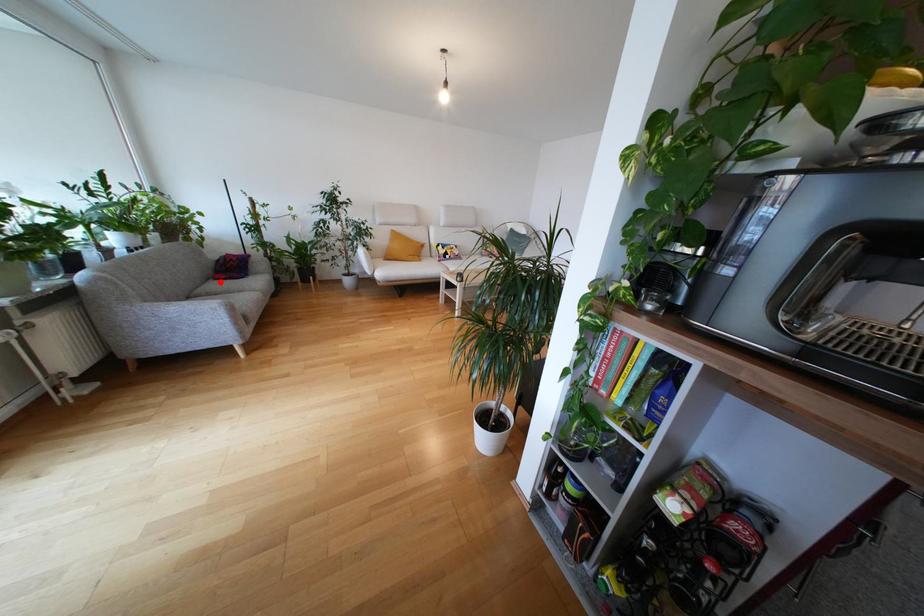
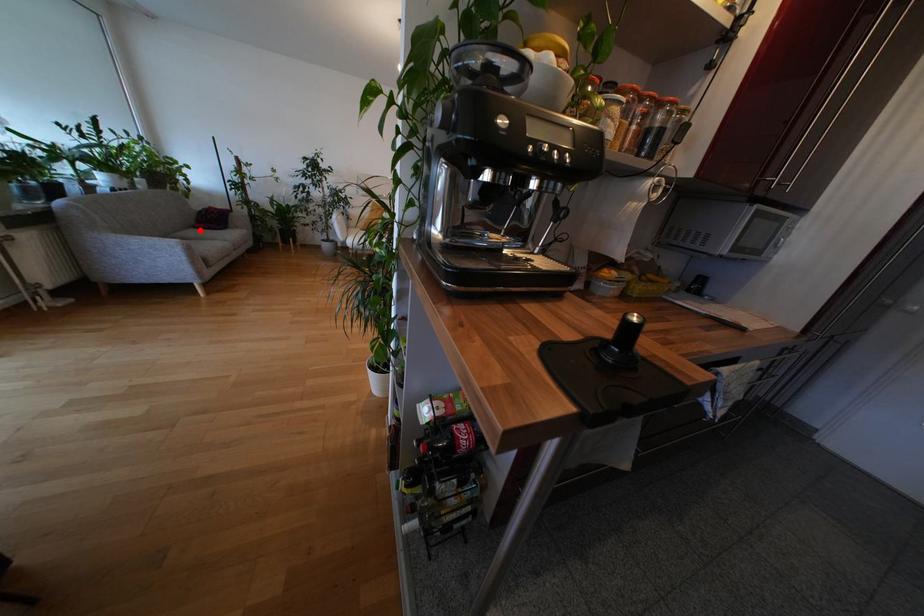
I am providing you with two images of the same scene from different viewpoints. A red point is marked on the first image and another point is marked on the second image. Is the red point in image1 aligned with the point shown in image2?

Yes